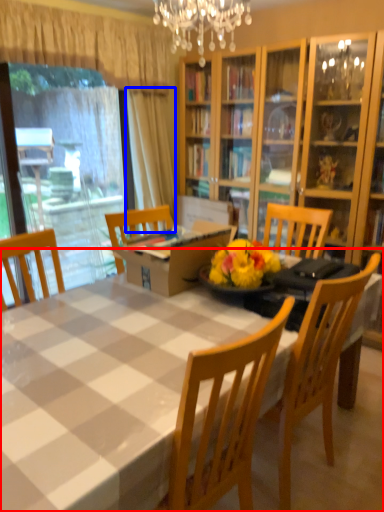
Question: Among these objects, which one is nearest to the camera, kitchen & dining room table (highlighted by a red box) or curtain (highlighted by a blue box)?

Choices:
 (A) kitchen & dining room table
 (B) curtain

Answer: (A)